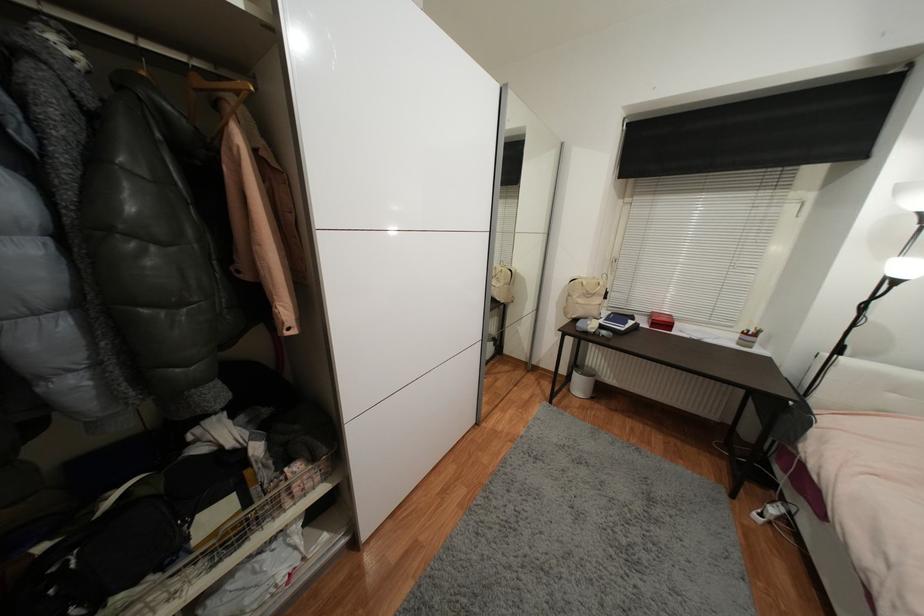
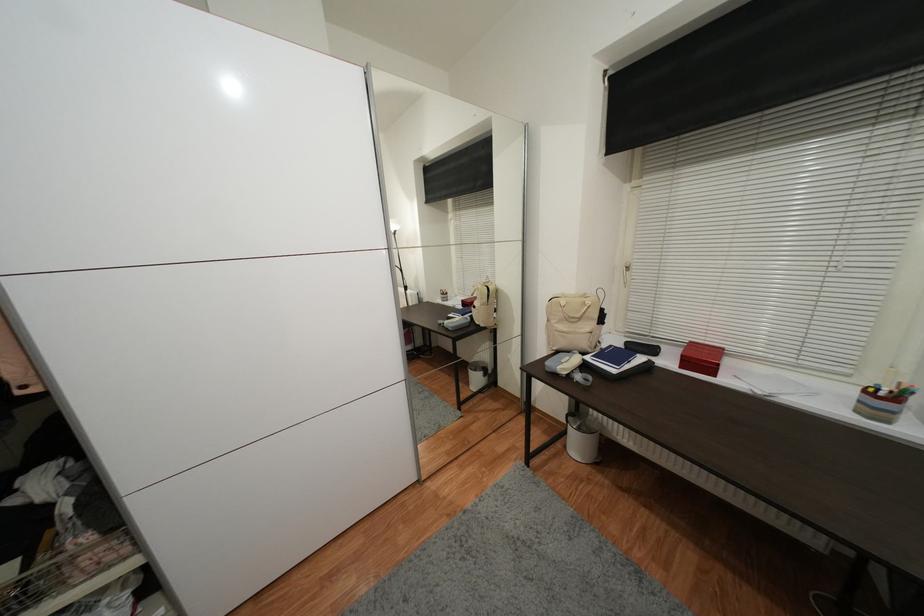
In the second image, find the point that corresponds to point 605,323 in the first image.

(592, 360)